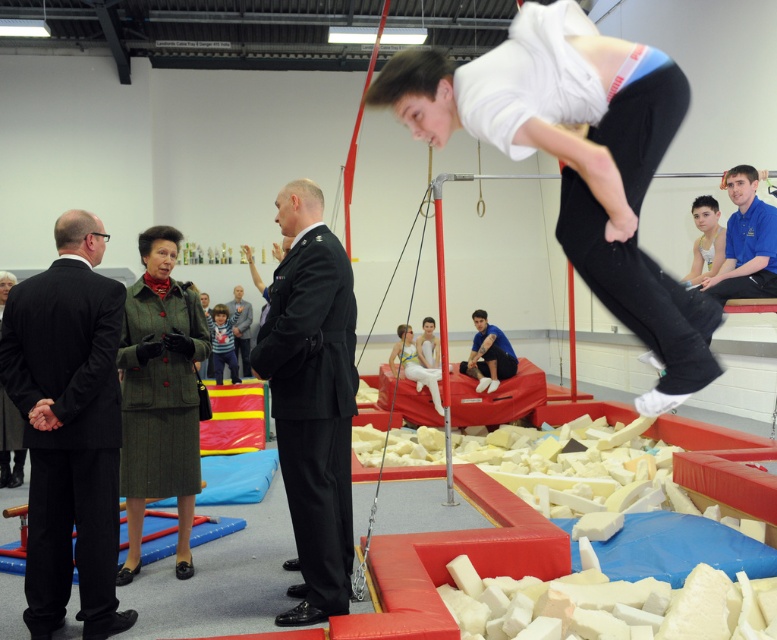
Question: Which of the following is the farthest from the observer?

Choices:
 (A) (472, 371)
 (B) (230, 304)
 (C) (230, 378)

Answer: (B)

Question: Is the position of black wool suit at left less distant than that of black uniform at center?

Choices:
 (A) yes
 (B) no

Answer: (A)

Question: Considering the relative positions of blue uniform shirt at upper center and dark gray suit at center in the image provided, where is blue uniform shirt at upper center located with respect to dark gray suit at center?

Choices:
 (A) left
 (B) right

Answer: (B)

Question: Which point is farther from the camera taking this photo?

Choices:
 (A) (239, 326)
 (B) (235, 371)

Answer: (A)

Question: Which object is the farthest from the dark gray suit at center?

Choices:
 (A) green wool coat at left
 (B) dark blue uniform at center
 (C) black uniform at center

Answer: (C)

Question: Is green woolen suit at center to the right of blue uniform shirt at upper center from the viewer's perspective?

Choices:
 (A) no
 (B) yes

Answer: (A)